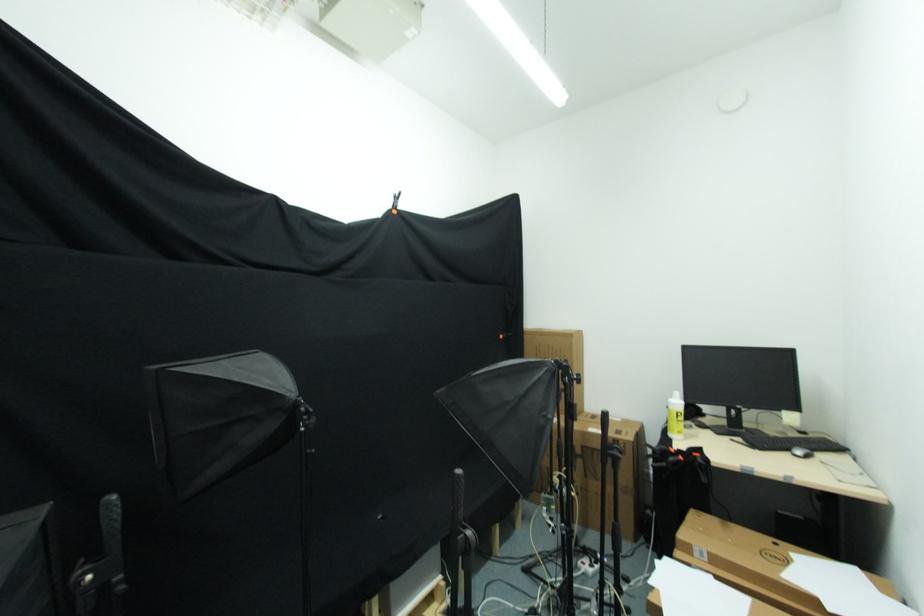
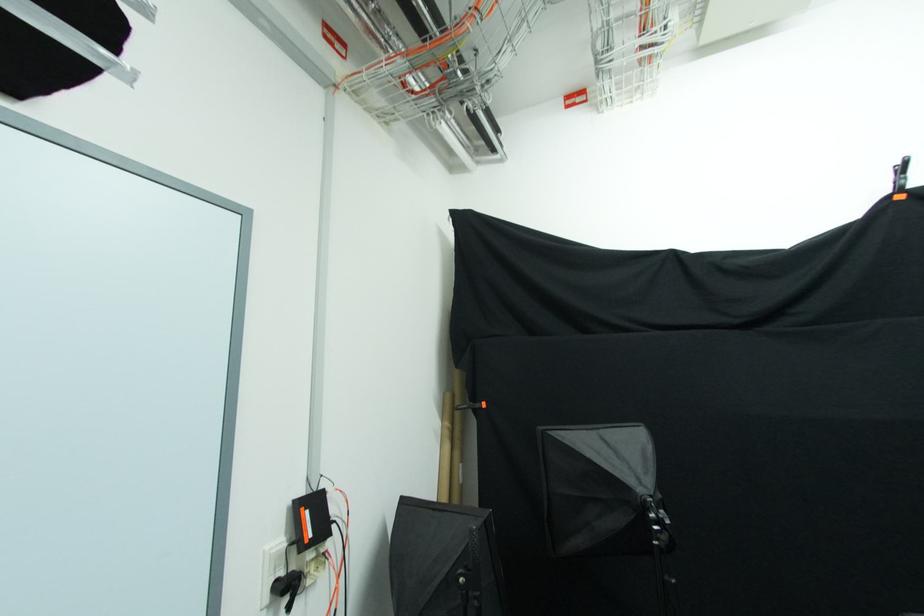
Question: Based on the continuous images, in which direction is the camera rotating? Reply with the corresponding letter.

Choices:
 (A) Left
 (B) Right
 (C) Up
 (D) Down

Answer: (A)